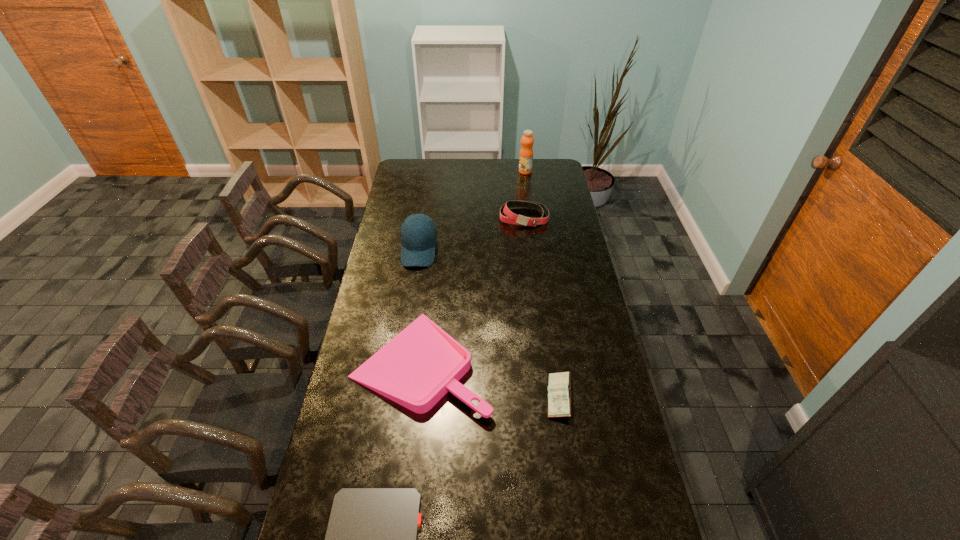
Identify the location of free spot that satisfies the following two spatial constraints: 1. on the front side of the third tallest object; 2. on the left side of the diary. The image size is (960, 540). (545, 397).